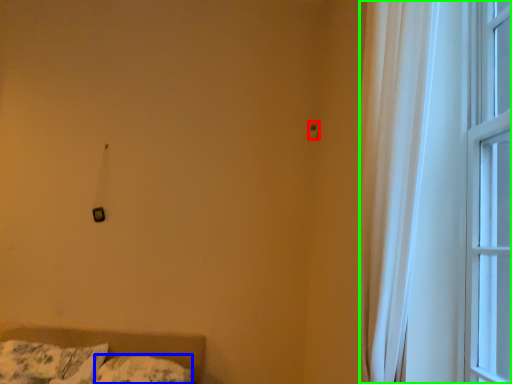
Question: Considering the real-world distances, which object is farthest from light switch (highlighted by a red box)? pillow (highlighted by a blue box) or window (highlighted by a green box)?

Choices:
 (A) pillow
 (B) window

Answer: (A)